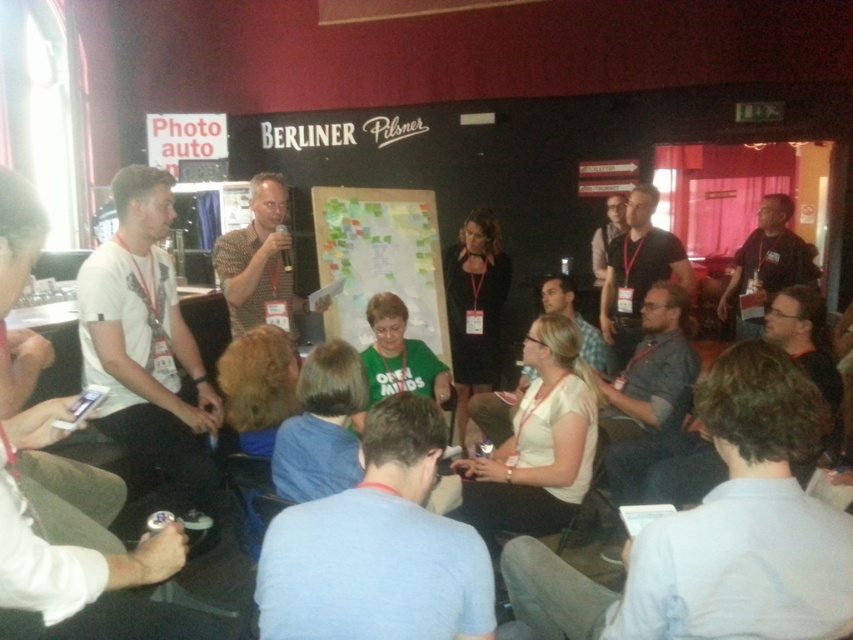
Question: Estimate the real-world distances between objects in this image. Which object is farther from the dark gray shirt at upper right?

Choices:
 (A) white shirt at center
 (B) brown textured shirt at center
 (C) green fabric map at center

Answer: (A)

Question: Does white t-shirt at left have a smaller size compared to matte gray shirt at center?

Choices:
 (A) yes
 (B) no

Answer: (B)

Question: Can you confirm if white shirt at center is smaller than matte gray shirt at center?

Choices:
 (A) no
 (B) yes

Answer: (A)

Question: Among these points, which one is farthest from the camera?

Choices:
 (A) (263, 221)
 (B) (486, 593)
 (C) (798, 236)
 (D) (759, 410)

Answer: (C)

Question: In this image, where is white shirt at center located relative to green fabric map at center?

Choices:
 (A) right
 (B) left

Answer: (A)

Question: Which point is farther from the camera taking this photo?

Choices:
 (A) [x=273, y=522]
 (B) [x=561, y=292]
 (C) [x=613, y=209]
 (D) [x=432, y=323]

Answer: (C)